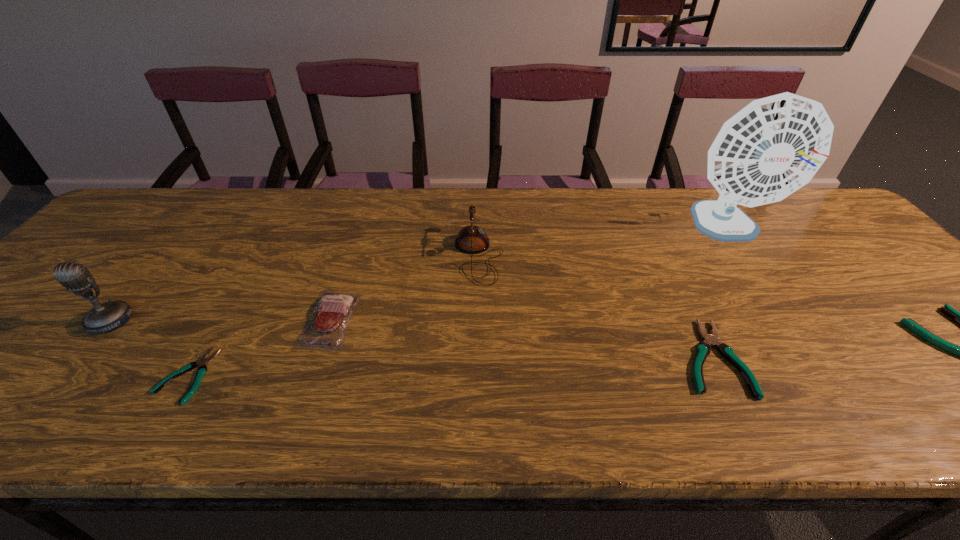
To make them evenly spaced by inserting another pliers among them, please locate a vacant spot for this new pliers. Please provide its 2D coordinates. Your answer should be formatted as a tuple, i.e. [(x, y)], where the tuple contains the x and y coordinates of a point satisfying the conditions above.

[(453, 366)]